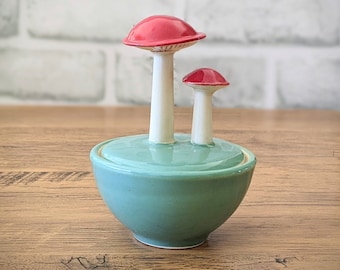
This screenshot has height=270, width=340. Identify the location of white bowl border. (246, 159).